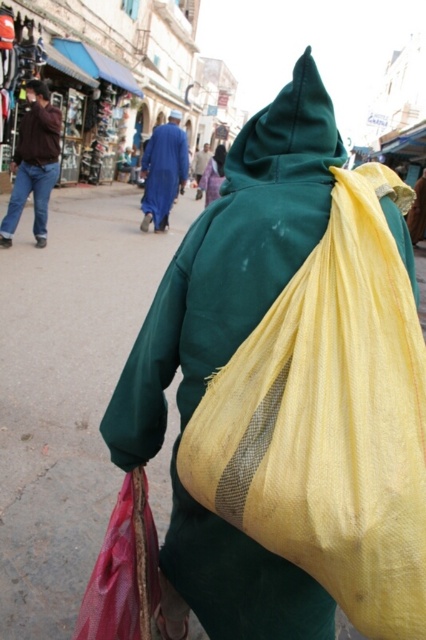
Question: Which of these objects is positioned farthest from the yellow woven bag at back?

Choices:
 (A) blue cotton robe at center
 (B) matte brown jacket at left

Answer: (A)

Question: Does matte brown jacket at left appear under blue cotton robe at center?

Choices:
 (A) yes
 (B) no

Answer: (A)

Question: Which point is closer to the camera?

Choices:
 (A) light purple fabric at center
 (B) matte brown jacket at left
 (C) red mesh bag at lower left

Answer: (C)

Question: Does yellow woven bag at back have a lesser width compared to matte brown jacket at left?

Choices:
 (A) no
 (B) yes

Answer: (B)

Question: Which of the following is the farthest from the observer?

Choices:
 (A) blue cotton robe at center
 (B) red mesh bag at lower left
 (C) matte brown jacket at left

Answer: (A)

Question: Does red mesh bag at lower left appear on the right side of blue cotton robe at center?

Choices:
 (A) no
 (B) yes

Answer: (B)